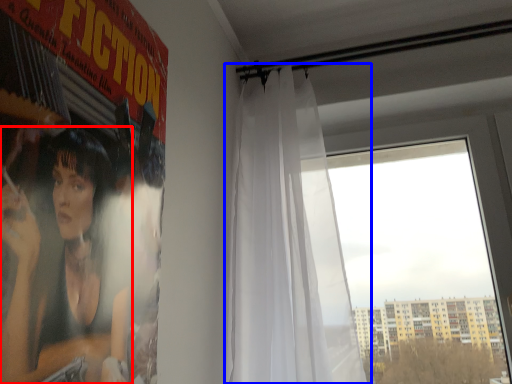
Question: Which of the following is the closest to the observer, person (highlighted by a red box) or curtain (highlighted by a blue box)?

Choices:
 (A) person
 (B) curtain

Answer: (A)